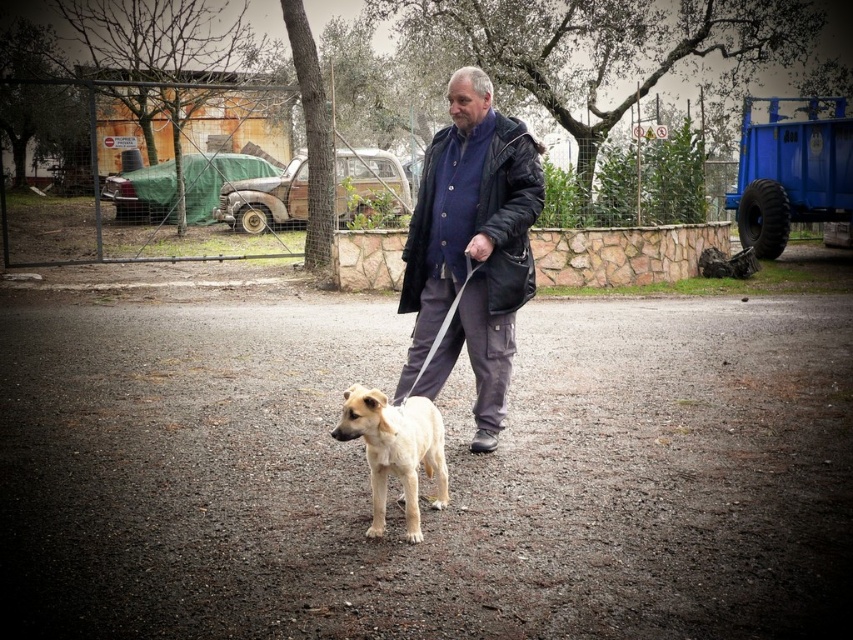
You are a photographer trying to capture a clear photo of the dark blue jacket at center and the light brown fur dog at center. Since you want both subjects to be in focus, which one should you adjust your camera focus on first?

The dark blue jacket at center is larger in size than the light brown fur dog at center, so you should focus on the dark blue jacket at center first to ensure both are in focus.

You are a photographer standing 10 feet away from the dark blue jacket at center and the light brown fur dog at center. You want to take a photo of both subjects in the same frame without moving them. Can you fit both subjects in the frame if your camera has a 50mm lens with a field of view of 46 degrees?

The dark blue jacket at center and light brown fur dog at center are 34.76 inches apart. Since the photographer is 10 feet away, the distance between them is within the camera lens field of view of 46 degrees, so both subjects can be captured in the same frame.